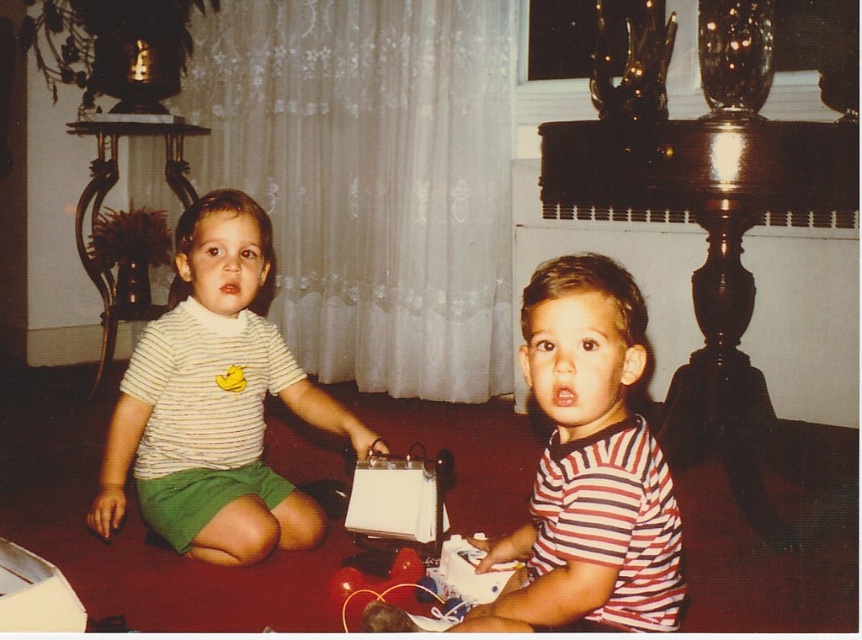
Who is taller, matte striped shirt at center or white paper bag at center?

matte striped shirt at center is taller.

Does point (233, 218) come closer to viewer compared to point (386, 456)?

Yes, point (233, 218) is in front of point (386, 456).

This screenshot has width=862, height=640. What do you see at coordinates (216, 403) in the screenshot?
I see `matte striped shirt at center` at bounding box center [216, 403].

The height and width of the screenshot is (640, 862). What are the coordinates of `matte striped shirt at center` in the screenshot? It's located at (216, 403).

Which is below, matte striped shirt at center or striped cotton shirt at center?

striped cotton shirt at center is below.

Is point (122, 488) positioned in front of point (589, 461)?

No, it is behind (589, 461).

The width and height of the screenshot is (862, 640). I want to click on matte striped shirt at center, so click(216, 403).

Is point (579, 456) in front of point (380, 452)?

Yes.

Is point (608, 573) positioned behind point (429, 484)?

No, (608, 573) is in front of (429, 484).

Between point (569, 259) and point (378, 461), which one is positioned in front?

Positioned in front is point (569, 259).

The height and width of the screenshot is (640, 862). Identify the location of striped cotton shirt at center. (590, 461).